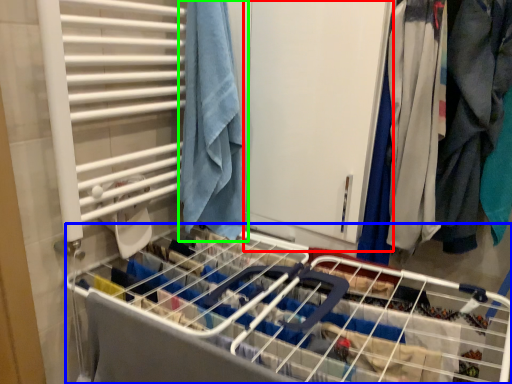
Question: Estimate the real-world distances between objects in this image. Which object is farther from screen door (highlighted by a red box), bed frame (highlighted by a blue box) or towel (highlighted by a green box)?

Choices:
 (A) bed frame
 (B) towel

Answer: (A)